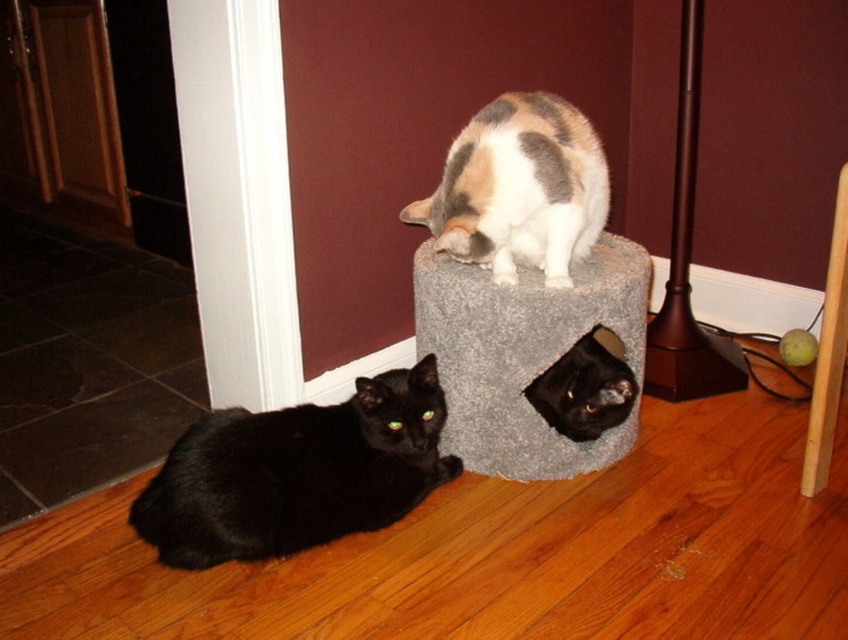
Is point (436, 340) farther from viewer compared to point (508, 172)?

Yes, point (436, 340) is farther from viewer.

Who is more distant from viewer, (422, 289) or (432, 212)?

The point (422, 289) is behind.

The height and width of the screenshot is (640, 848). What are the coordinates of `gray carpeted cat bed at center` in the screenshot? It's located at (522, 352).

Is black fur cat at lower left smaller than black fur cat at lower center?

Actually, black fur cat at lower left might be larger than black fur cat at lower center.

Between point (286, 467) and point (558, 422), which one is positioned behind?

Point (558, 422)

The image size is (848, 640). I want to click on black fur cat at lower left, so click(296, 472).

Is black fur cat at lower left positioned at the back of gray carpeted cat bed at center?

That is False.

Describe the element at coordinates (296, 472) in the screenshot. I see `black fur cat at lower left` at that location.

Is point (235, 435) farther from camera compared to point (640, 314)?

That is False.

The height and width of the screenshot is (640, 848). In order to click on black fur cat at lower left in this screenshot , I will do `click(296, 472)`.